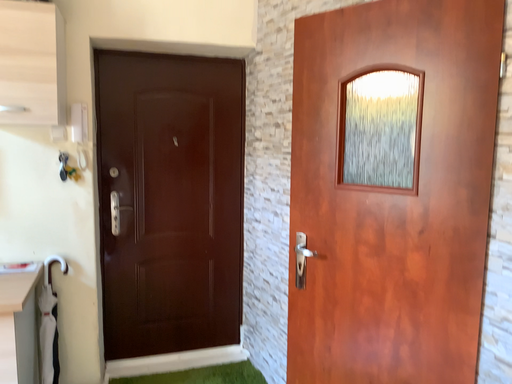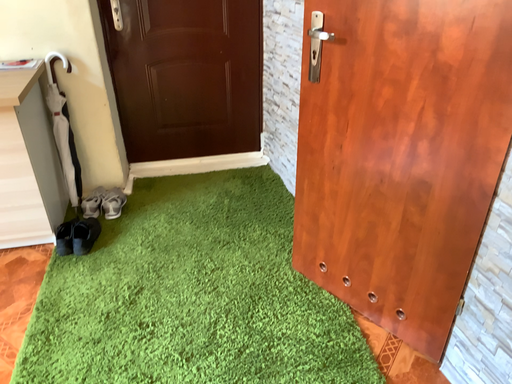
Question: How did the camera likely rotate when shooting the video?

Choices:
 (A) rotated downward
 (B) rotated upward

Answer: (A)